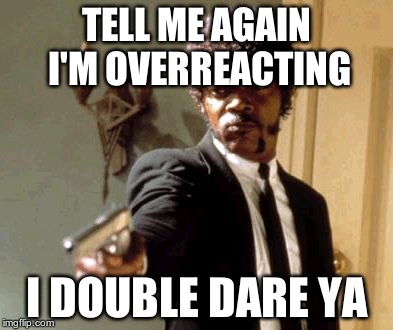
This screenshot has height=330, width=393. I want to click on door, so click(342, 218).